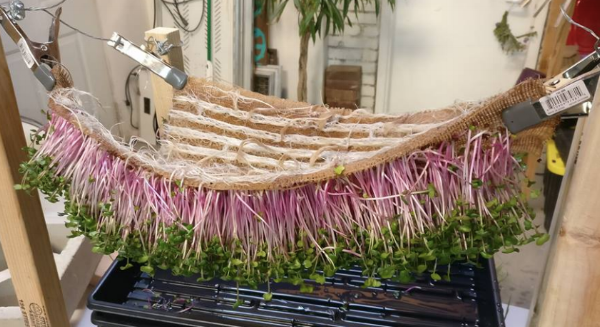
Find the location of `white bricks`. white bricks is located at coordinates (356, 39).